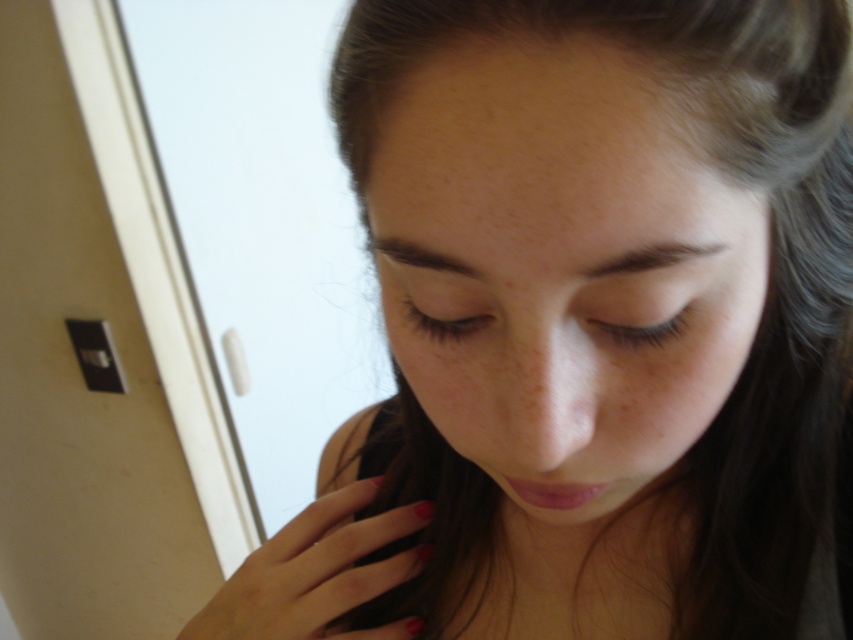
You are a photographer adjusting the camera focus. You need to ensure both the smooth skin face at center and the polished red nails at lower center are in focus. Given that the depth of field can only sharply focus on one object at a time, which object should you prioritize focusing on to ensure the larger subject is clear?

The smooth skin face at center is bigger than the polished red nails at lower center, so you should prioritize focusing on the smooth skin face at center to ensure the larger subject is clear.

You are standing in a room and see two points marked on the wall. The first point is at coordinates point (570,205) and the second point is at point (320,592). If you were to walk towards the wall, which point would you encounter first?

Point (570,205) is in front of point (320,592), so you would encounter point (570,205) first when walking towards the wall.